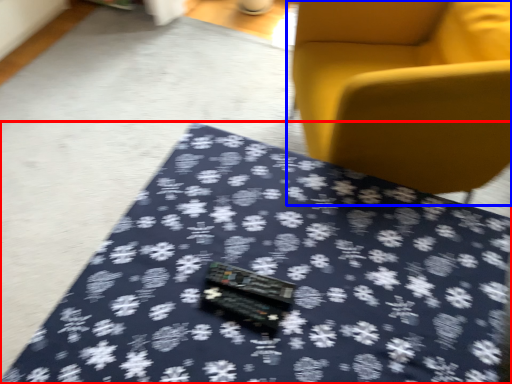
Question: Which object is closer to the camera taking this photo, table (highlighted by a red box) or chair (highlighted by a blue box)?

Choices:
 (A) table
 (B) chair

Answer: (A)